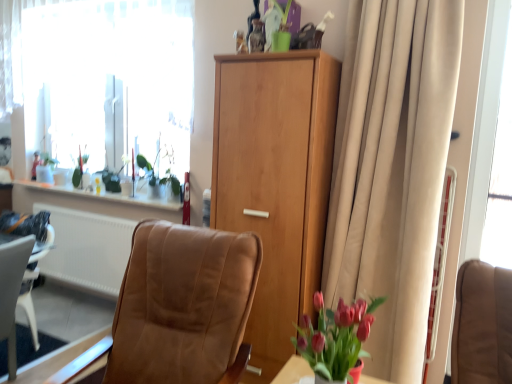
Question: Considering the relative positions of light brown wood cabinet at center and leather-like brown chair at center in the image provided, is light brown wood cabinet at center to the right of leather-like brown chair at center from the viewer's perspective?

Choices:
 (A) no
 (B) yes

Answer: (B)

Question: Is light brown wood cabinet at center outside leather-like brown chair at center?

Choices:
 (A) yes
 (B) no

Answer: (A)

Question: Considering the relative sizes of light brown wood cabinet at center and leather-like brown chair at center in the image provided, is light brown wood cabinet at center wider than leather-like brown chair at center?

Choices:
 (A) yes
 (B) no

Answer: (B)

Question: Is light brown wood cabinet at center aimed at leather-like brown chair at center?

Choices:
 (A) yes
 (B) no

Answer: (A)

Question: Considering the relative positions of light brown wood cabinet at center and leather-like brown chair at center in the image provided, is light brown wood cabinet at center in front of leather-like brown chair at center?

Choices:
 (A) yes
 (B) no

Answer: (B)

Question: Does point (172, 196) appear closer or farther from the camera than point (506, 241)?

Choices:
 (A) closer
 (B) farther

Answer: (B)

Question: Looking at their shapes, would you say green matte plant at upper left, marked as the first plant in a right-to-left arrangement, is wider or thinner than transparent glass window screen at right?

Choices:
 (A) thin
 (B) wide

Answer: (B)

Question: Considering the positions of green matte plant at upper left, which is the second plant in left-to-right order, and transparent glass window screen at right in the image, is green matte plant at upper left, which is the second plant in left-to-right order, taller or shorter than transparent glass window screen at right?

Choices:
 (A) short
 (B) tall

Answer: (A)

Question: Considering their positions, is green matte plant at upper left, which is the second plant in left-to-right order, located in front of or behind transparent glass window screen at right?

Choices:
 (A) behind
 (B) front

Answer: (A)

Question: From a real-world perspective, relative to green matte plant at upper left, the 2th plant positioned from the back, is beige fabric curtain at right vertically above or below?

Choices:
 (A) below
 (B) above

Answer: (A)

Question: From the image's perspective, relative to green matte plant at upper left, which is the 1th plant from front to back, is beige fabric curtain at right above or below?

Choices:
 (A) above
 (B) below

Answer: (B)

Question: In terms of size, does beige fabric curtain at right appear bigger or smaller than green matte plant at upper left, marked as the first plant in a right-to-left arrangement?

Choices:
 (A) big
 (B) small

Answer: (A)

Question: In the image, is beige fabric curtain at right on the left side or the right side of green matte plant at upper left, the 2th plant positioned from the back?

Choices:
 (A) left
 (B) right

Answer: (B)

Question: Considering the positions of beige fabric curtain at right and green glossy vase at upper left, marked as the second plant in a right-to-left arrangement, in the image, is beige fabric curtain at right bigger or smaller than green glossy vase at upper left, marked as the second plant in a right-to-left arrangement,?

Choices:
 (A) big
 (B) small

Answer: (A)

Question: From a real-world perspective, relative to green glossy vase at upper left, which appears as the second plant when viewed from the front, is beige fabric curtain at right vertically above or below?

Choices:
 (A) below
 (B) above

Answer: (B)